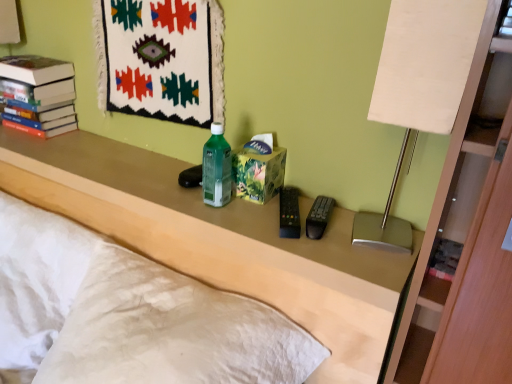
Question: Is white textured pillow at lower left located outside matte beige table lamp at right?

Choices:
 (A) no
 (B) yes

Answer: (B)

Question: Does white textured pillow at lower left come in front of matte beige table lamp at right?

Choices:
 (A) no
 (B) yes

Answer: (A)

Question: Can you confirm if white textured pillow at lower left is smaller than matte beige table lamp at right?

Choices:
 (A) yes
 (B) no

Answer: (B)

Question: Can you confirm if white textured pillow at lower left is wider than matte beige table lamp at right?

Choices:
 (A) yes
 (B) no

Answer: (A)

Question: From a real-world perspective, is white textured pillow at lower left under matte beige table lamp at right?

Choices:
 (A) no
 (B) yes

Answer: (B)

Question: Is white textured pillow at lower left shorter than matte beige table lamp at right?

Choices:
 (A) yes
 (B) no

Answer: (B)

Question: Does hardcover books at upper left have a larger size compared to matte beige table lamp at right?

Choices:
 (A) yes
 (B) no

Answer: (A)

Question: Is the position of hardcover books at upper left less distant than that of matte beige table lamp at right?

Choices:
 (A) yes
 (B) no

Answer: (B)

Question: Does hardcover books at upper left have a greater width compared to matte beige table lamp at right?

Choices:
 (A) no
 (B) yes

Answer: (B)

Question: Can you confirm if hardcover books at upper left is taller than matte beige table lamp at right?

Choices:
 (A) no
 (B) yes

Answer: (A)

Question: Is there a large distance between hardcover books at upper left and matte beige table lamp at right?

Choices:
 (A) no
 (B) yes

Answer: (B)

Question: Does hardcover books at upper left have a smaller size compared to matte beige table lamp at right?

Choices:
 (A) no
 (B) yes

Answer: (A)

Question: Does matte beige table lamp at right have a larger size compared to matte plastic remote control at center?

Choices:
 (A) no
 (B) yes

Answer: (A)